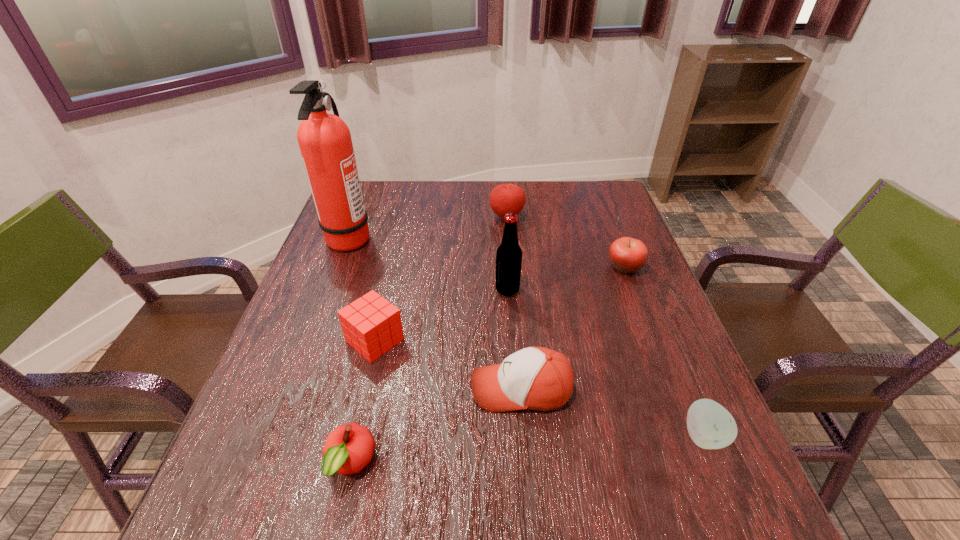
Find the location of a particular element. This screenshot has width=960, height=540. the tallest object is located at coordinates (325, 143).

In order to click on the leftmost object in this screenshot , I will do point(325,143).

This screenshot has height=540, width=960. Find the location of `the fifth nearest object`. the fifth nearest object is located at coordinates (509, 254).

Locate an element on the screen. The width and height of the screenshot is (960, 540). the seventh shortest object is located at coordinates (509, 254).

Find the location of a particular element. The width and height of the screenshot is (960, 540). the second apple from left to right is located at coordinates (506, 198).

Locate an element on the screen. This screenshot has width=960, height=540. the farthest apple is located at coordinates (506, 198).

Where is `baseball cap`? baseball cap is located at coordinates (537, 378).

Identify the location of the fourth nearest object. This screenshot has width=960, height=540. (371, 325).

Find the location of `the second farthest apple`. the second farthest apple is located at coordinates (626, 254).

This screenshot has height=540, width=960. Find the location of `the leftmost apple`. the leftmost apple is located at coordinates (348, 449).